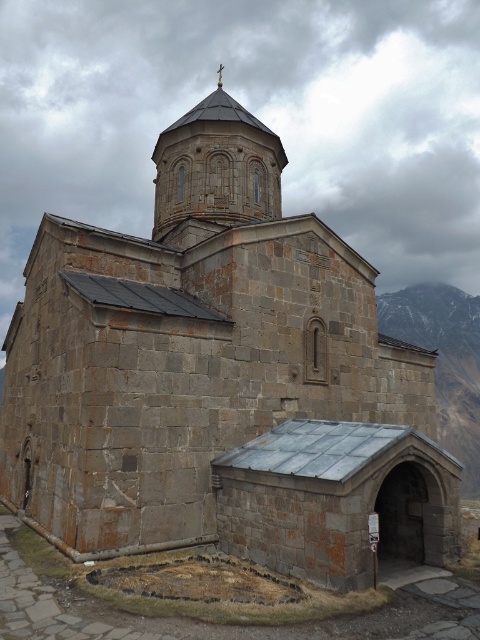
In the scene shown: You are a drone operator tasked with capturing aerial footage of the stone spire at upper center and the snowy granite mountain at right. The drone has a maximum flight range of 80 meters. Can the drone safely capture both locations in a single flight without returning to the charging station?

The stone spire at upper center and the snowy granite mountain at right are 77.56 meters apart. Since the distance between them is within the drone maximum flight range of 80 meters, the drone can safely capture both locations in a single flight without needing to return to the charging station.

You are standing at the entrance of the stone church and want to locate the stone spire at upper center. Based on the coordinates provided, where would you look to find it?

The stone spire at upper center is located at coordinates point (x=215, y=170), so you should look towards the upper center area of the church structure.

You are standing in front of the church and notice two points marked on the structure. The first point is at coordinates point (x=187, y=125) and the second at point (x=459, y=348). Which of these points is closer to you as you face the church?

Point (x=187, y=125) is in front of point (x=459, y=348), so the first point is closer to you as you face the church.